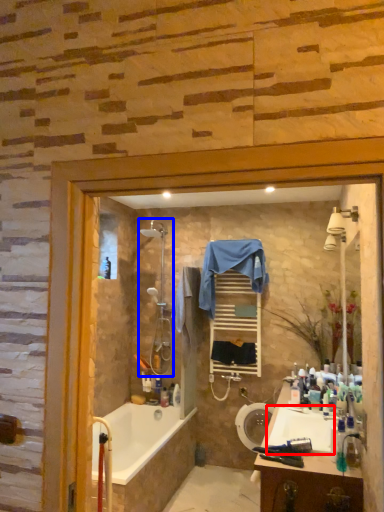
Question: Which object appears closest to the camera in this image, sink (highlighted by a red box) or shower (highlighted by a blue box)?

Choices:
 (A) sink
 (B) shower

Answer: (A)